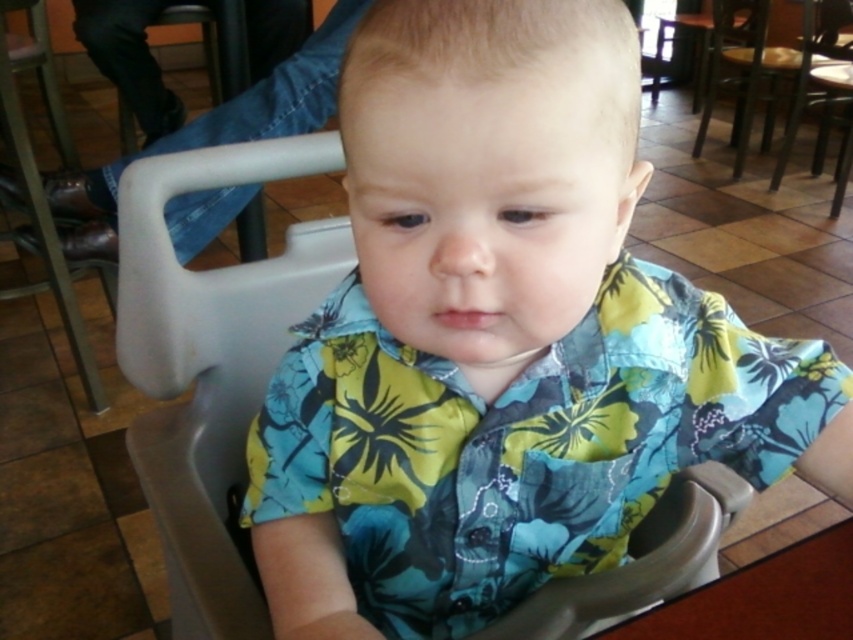
Question: Among these objects, which one is nearest to the camera?

Choices:
 (A) brown wooden table at lower right
 (B) gray plastic chair at center
 (C) wooden chair at center

Answer: (A)

Question: Observing the image, what is the correct spatial positioning of gray plastic chair at center in reference to metallic gray chair at center?

Choices:
 (A) above
 (B) below

Answer: (B)

Question: Which object is farther from the camera taking this photo?

Choices:
 (A) metallic gray chair at center
 (B) brown wooden table at lower right
 (C) wooden chair at center
 (D) gray plastic chair at center

Answer: (C)

Question: Does gray plastic chair at center have a larger size compared to wooden chair at center?

Choices:
 (A) yes
 (B) no

Answer: (B)

Question: Does wooden chair at center have a greater width compared to metallic gray chair at center?

Choices:
 (A) yes
 (B) no

Answer: (B)

Question: Among these points, which one is nearest to the camera?

Choices:
 (A) (799, 596)
 (B) (711, 92)
 (C) (224, 515)
 (D) (810, 100)

Answer: (A)